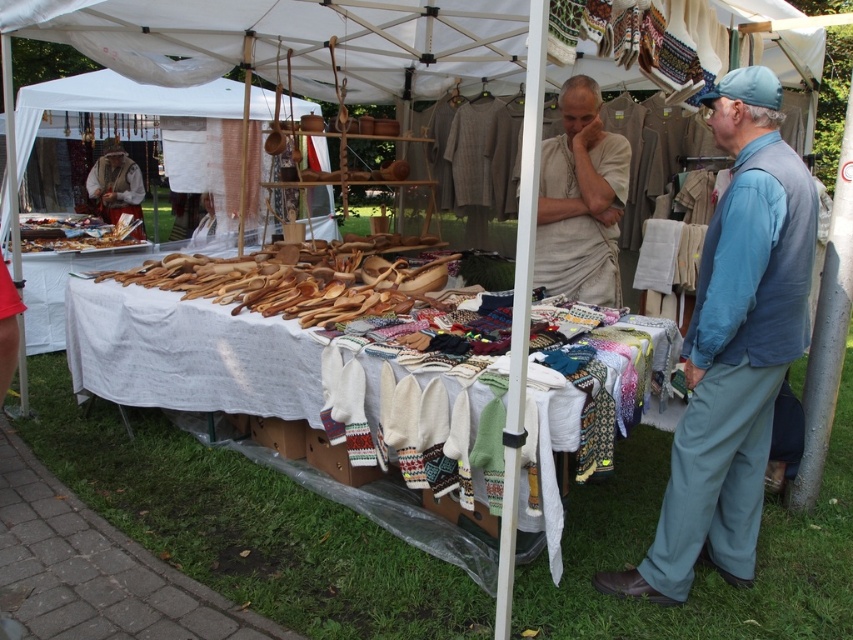
You are standing at the market stall and want to place a new item between the two points marked as point (663, 518) and point (22, 308). Which point should you place it closer to if you want it to be more visible to customers walking by?

You should place the new item closer to point (22, 308) because it is closer to the viewer, making it more visible to customers walking by.

You are a customer at the market stall and want to know if the white woven fabric at center can be folded to fit into a box that is the same height as the red fabric dress at lower left. Based on their heights, can it fit?

The white woven fabric at center is taller than the red fabric dress at lower left. Since the box is only as tall as the dress, the white woven fabric at center cannot be folded to fit into the box without exceeding its height.